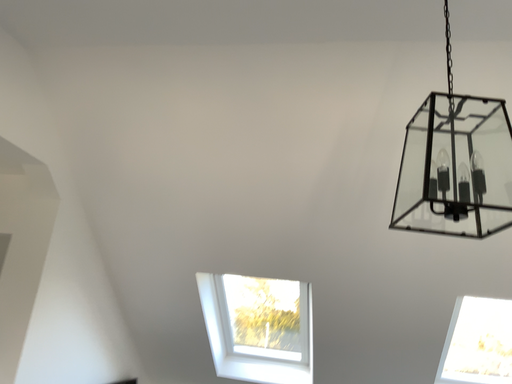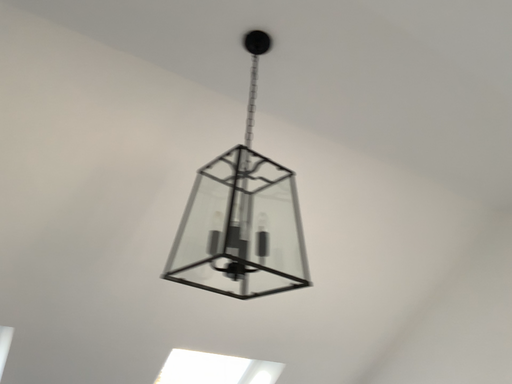
Question: Which way did the camera rotate in the video?

Choices:
 (A) rotated right
 (B) rotated left

Answer: (A)